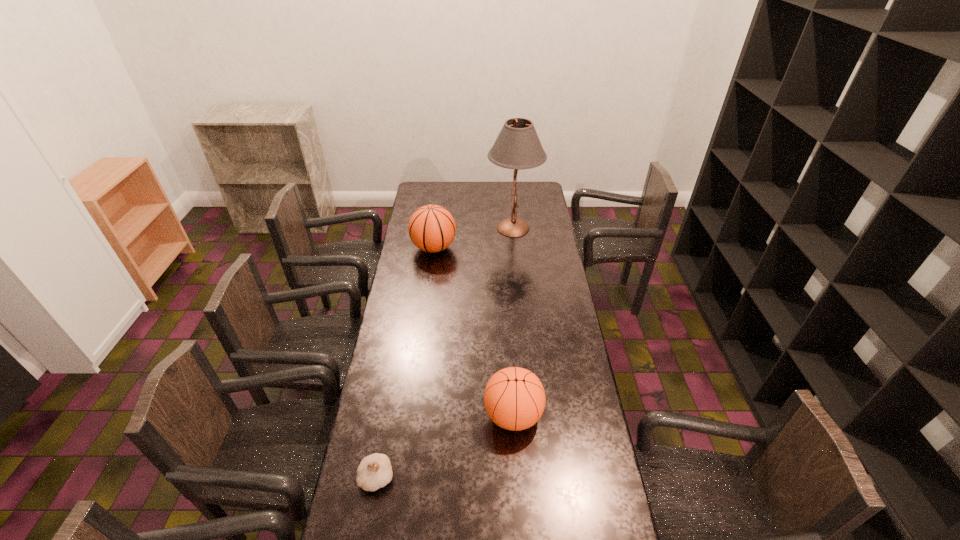
This screenshot has height=540, width=960. In order to click on object that ranks as the second closest to the nearer basketball in this screenshot , I will do `click(431, 228)`.

Point out which object is positioned as the third nearest to the garlic. Please provide its 2D coordinates. Your answer should be formatted as a tuple, i.e. [(x, y)], where the tuple contains the x and y coordinates of a point satisfying the conditions above.

[(518, 147)]

Identify the location of free space that satisfies the following two spatial constraints: 1. on the front side of the second nearest object; 2. on the left side of the taller basketball. This screenshot has width=960, height=540. (412, 415).

I want to click on vacant space that satisfies the following two spatial constraints: 1. on the front side of the shorter basketball; 2. on the right side of the left basketball, so click(412, 415).